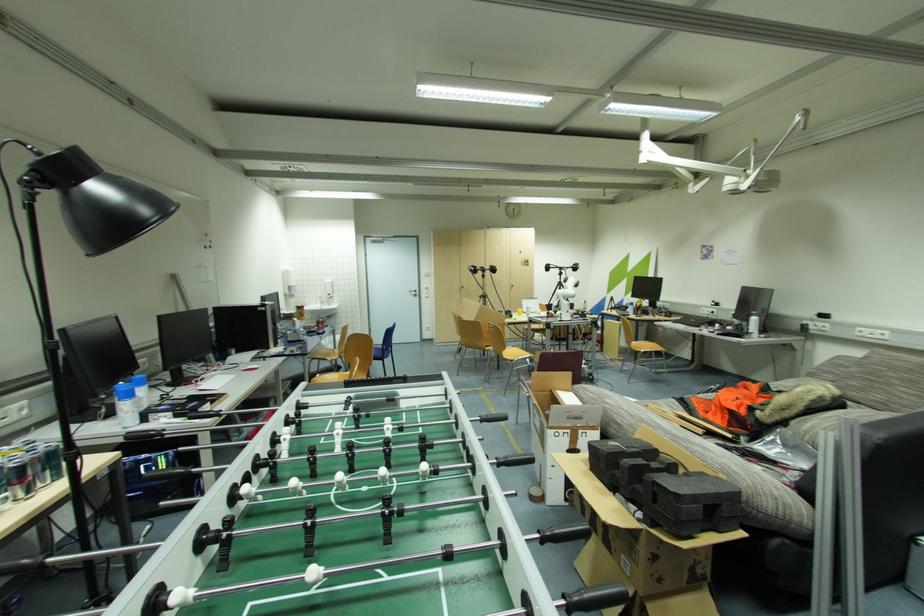
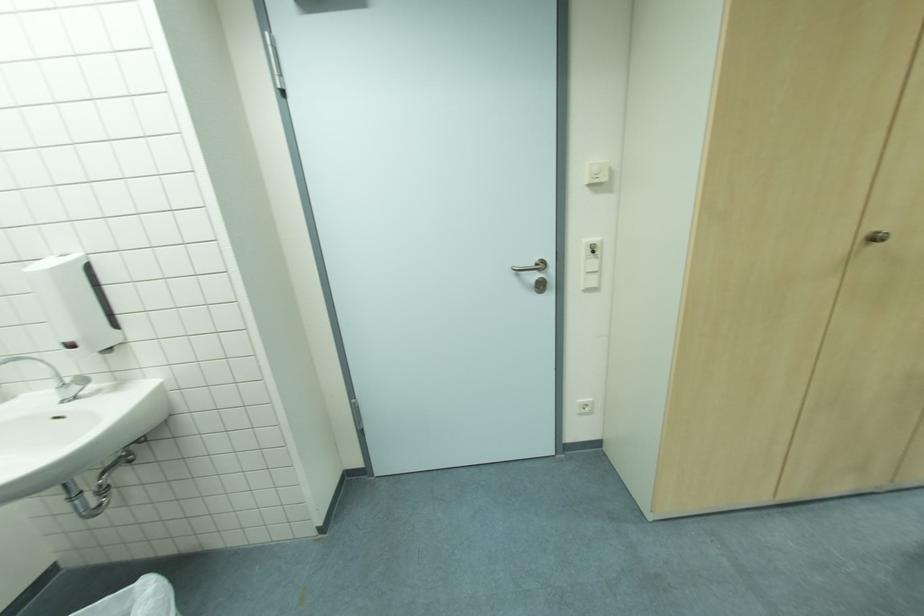
Where in the second image is the point corresponding to (431,296) from the first image?

(598, 285)